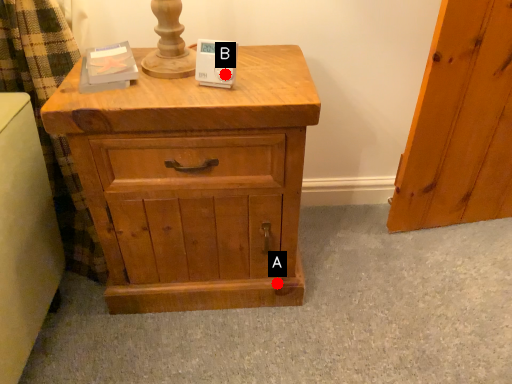
Question: Two points are circled on the image, labeled by A and B beside each circle. Which point is farther from the camera taking this photo?

Choices:
 (A) A is further
 (B) B is further

Answer: (A)